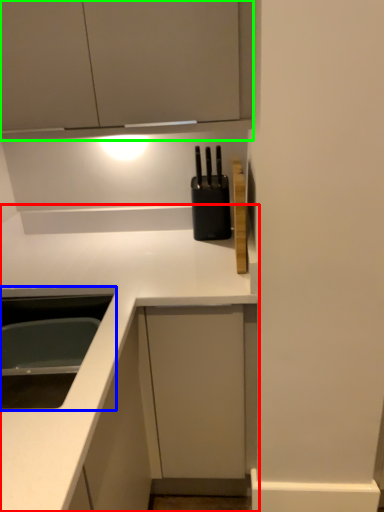
Question: Which object is the farthest from countertop (highlighted by a red box)? Choose among these: sink (highlighted by a blue box) or cabinetry (highlighted by a green box).

Choices:
 (A) sink
 (B) cabinetry

Answer: (B)